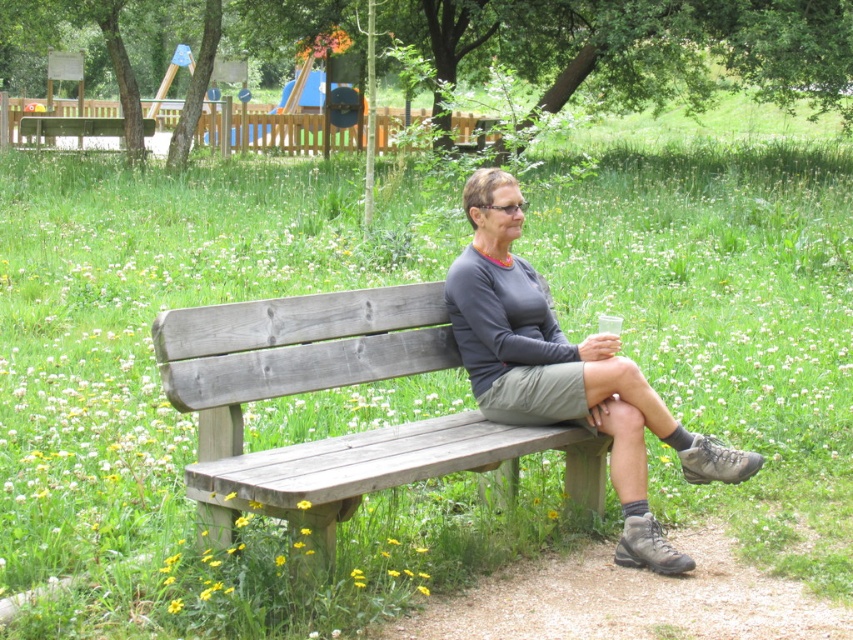
You are a photographer aiming to capture a closeup shot of the gray wooden bench at center and the matte gray shirt at center. Given that your camera can focus on objects within a 20 inch range, will both items be in focus at the same time?

The gray wooden bench at center is 20.71 inches from matte gray shirt at center. Since the distance between them exceeds the camera focus range of 20 inches, they cannot both be in focus simultaneously.

You are standing at the point with coordinates (329, 387). Based on the scene description, what object are you currently standing on?

The point at coordinates (329, 387) is on the gray wooden bench at center, so you are standing on the gray wooden bench at center.